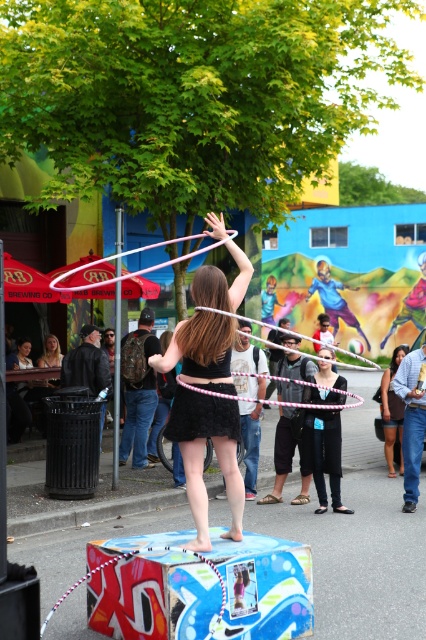
You are a photographer at the event and want to capture a photo of the performer in the black matte dress at center and the matte black dress at center. Which one appears taller in the photo?

The black matte dress at center appears taller than the matte black dress at center in the photo.

You are a photographer at the event and want to capture a closeup shot of the young woman. You need to ensure that both the matte black backpack at center and the blonde hair at center are visible in the frame. Which object should you adjust your camera angle to prioritize if you can only focus on one due to limited space?

The matte black backpack at center is wider than the blonde hair at center, so you should prioritize adjusting your camera angle to ensure the wider matte black backpack at center fits in the frame first.

You are a photographer at the event and want to capture the performer. Since the matte pink hula hoop at center and the blonde hair at center are both at the center, which one should you focus on to ensure the subject is in focus?

The matte pink hula hoop at center has a larger size compared to blonde hair at center, so focusing on the matte pink hula hoop at center would ensure the subject is in focus as it is the more prominent feature.